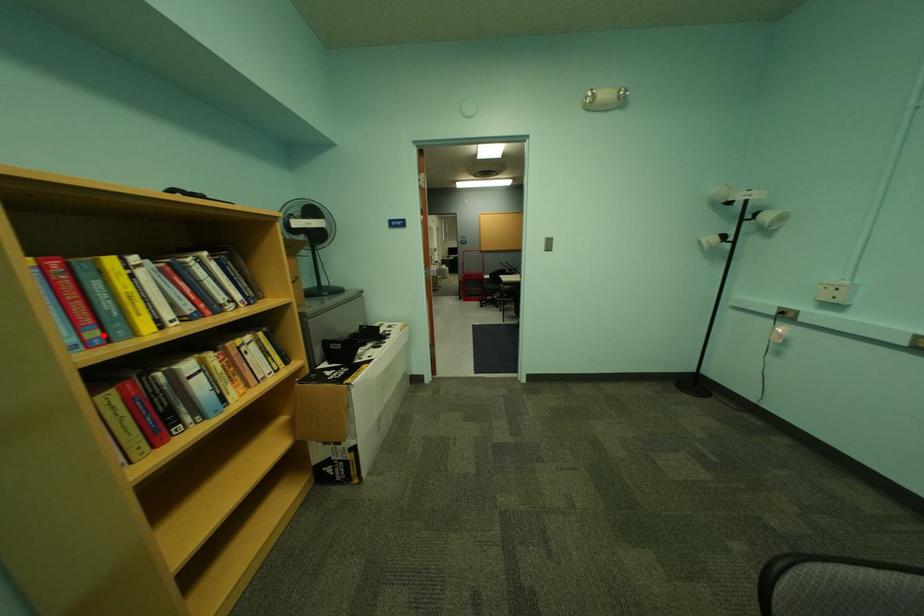
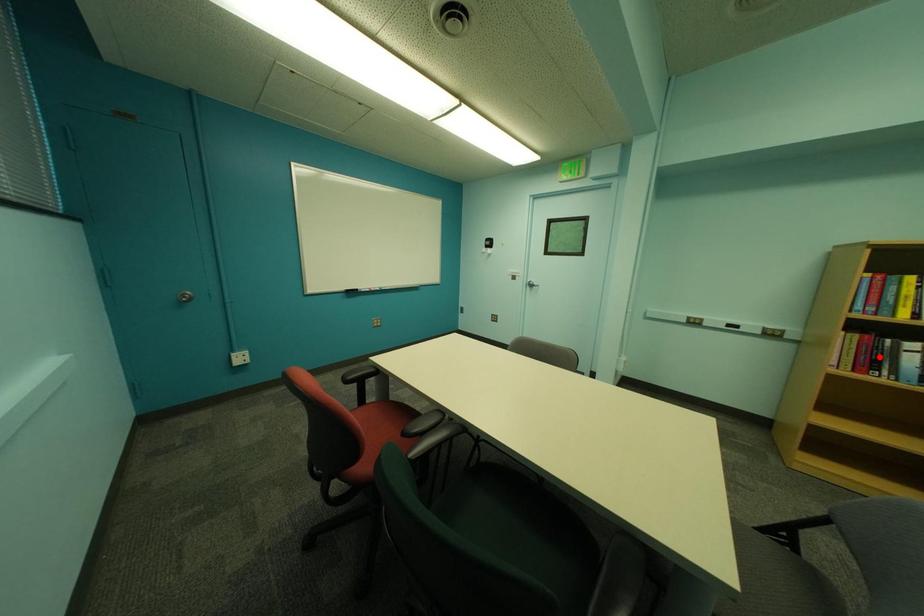
I am providing you with two images of the same scene from different viewpoints. A red point is marked on the first image and another point is marked on the second image. Are the points marked in image1 and image2 representing the same 3D position?

No